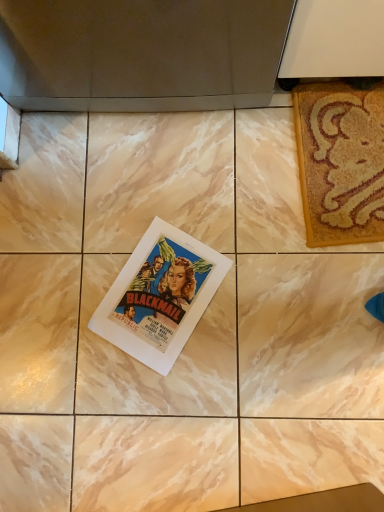
This screenshot has height=512, width=384. What are the coordinates of `vacant space to the left of white paper at center` in the screenshot? It's located at (67, 318).